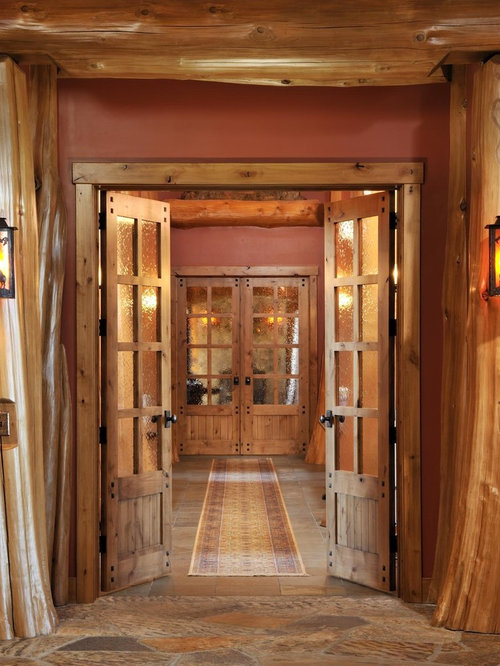
Identify the location of door hinges. coord(396,218), coord(394,322), coord(396,435), coord(394,543), coord(99,543), coord(102,438), coord(102,322), coord(101,216).